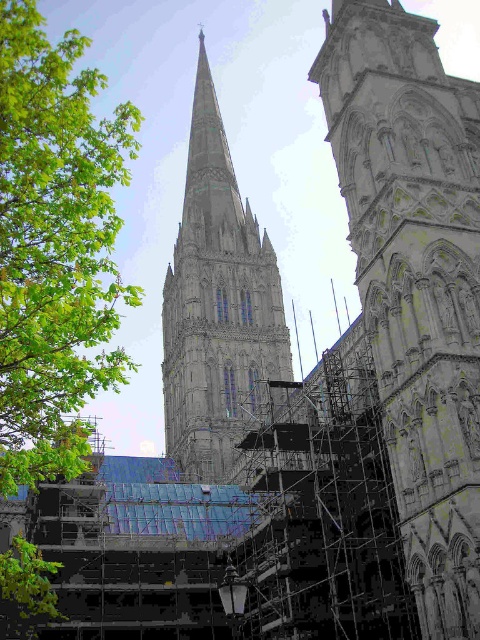
Question: Does white stone tower at center appear on the left side of green leafy tree at left?

Choices:
 (A) yes
 (B) no

Answer: (B)

Question: Does white stone tower at center have a lesser width compared to green leafy tree at left?

Choices:
 (A) no
 (B) yes

Answer: (B)

Question: Which object appears farthest from the camera in this image?

Choices:
 (A) stone steeple at center
 (B) white stone tower at center

Answer: (A)

Question: In this image, where is white stone tower at center located relative to green leafy tree at left?

Choices:
 (A) right
 (B) left

Answer: (A)

Question: Which point is closer to the camera?

Choices:
 (A) stone steeple at center
 (B) white stone tower at center

Answer: (B)

Question: Which point is farther from the camera taking this photo?

Choices:
 (A) (400, 161)
 (B) (180, 460)

Answer: (B)